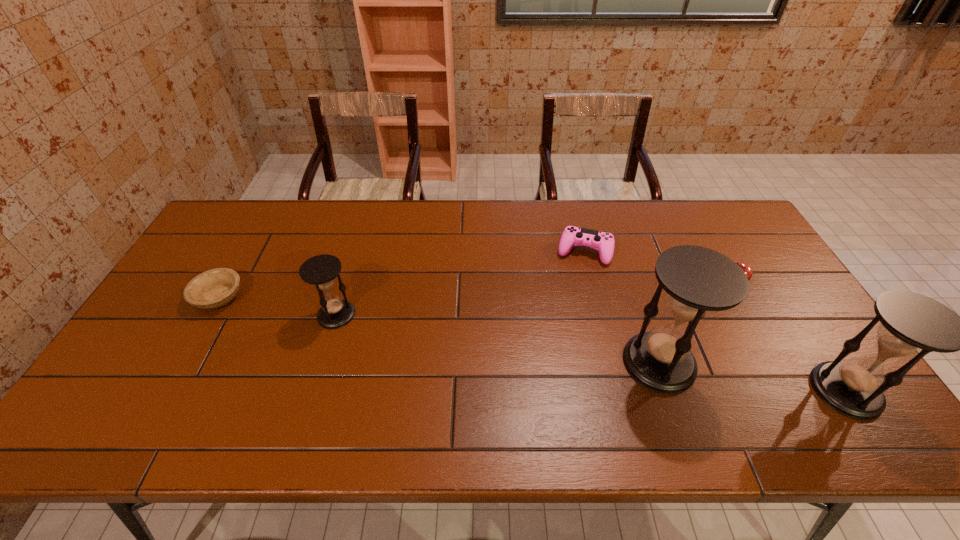
This screenshot has height=540, width=960. I want to click on free space for an extra hourglass to achieve even spacing, so click(490, 338).